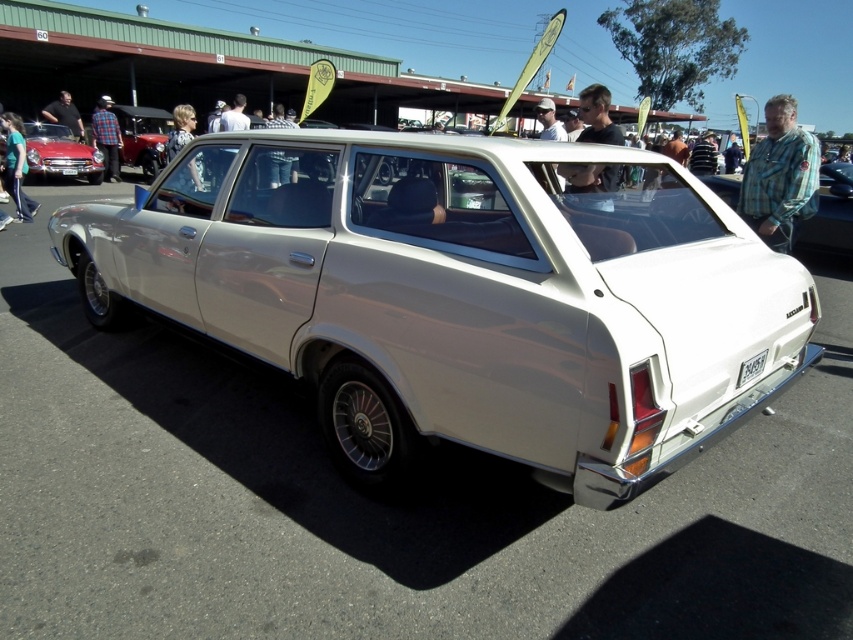
Question: Does matte white station wagon at center lie behind matte black shirt at left?

Choices:
 (A) no
 (B) yes

Answer: (A)

Question: Which point is farther to the camera?

Choices:
 (A) matte black shirt at left
 (B) green fabric pants at left

Answer: (A)

Question: Is the position of light brown hair at center less distant than that of white plastic license plate at lower center?

Choices:
 (A) yes
 (B) no

Answer: (B)

Question: Can you confirm if light brown hair at center is wider than checkered fabric shirt at center?

Choices:
 (A) yes
 (B) no

Answer: (A)

Question: Which object is farther from the camera taking this photo?

Choices:
 (A) matte white station wagon at center
 (B) matte black shirt at upper center
 (C) checkered fabric shirt at center
 (D) shiny red car at left

Answer: (D)

Question: Based on their relative distances, which object is nearer to the matte black shirt at upper center?

Choices:
 (A) matte black shirt at left
 (B) checkered fabric shirt at upper right
 (C) green fabric pants at left

Answer: (B)